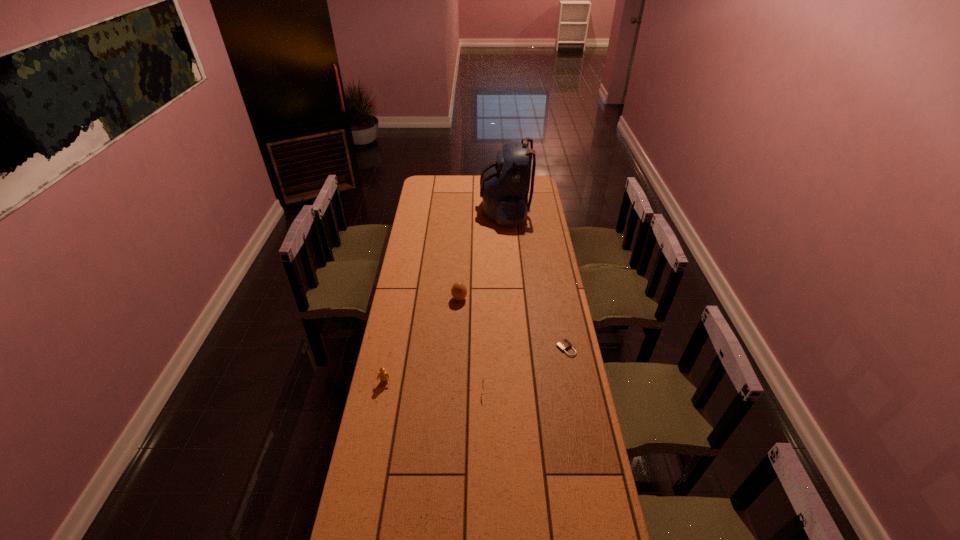
Find the location of a particular element. The height and width of the screenshot is (540, 960). vacant region located 0.150m at the front pocket of the tallest object is located at coordinates (455, 210).

Image resolution: width=960 pixels, height=540 pixels. I want to click on free space located at the front pocket of the tallest object, so click(445, 210).

Image resolution: width=960 pixels, height=540 pixels. I want to click on free space located 0.210m on the right of the second tallest object, so click(512, 299).

What are the coordinates of `free space located 0.060m on the face of the Lego` in the screenshot? It's located at (381, 399).

Find the location of a particular element. The image size is (960, 540). blank space located in front of the lenses of the sunglasses is located at coordinates (422, 390).

Image resolution: width=960 pixels, height=540 pixels. Identify the location of vacant space positioned in front of the lenses of the sunglasses. (392, 390).

This screenshot has width=960, height=540. Find the location of `blank area located in front of the lenses of the sunglasses`. blank area located in front of the lenses of the sunglasses is located at coordinates (396, 390).

Locate an element on the screen. This screenshot has height=540, width=960. free space located on the back of the shortest object is located at coordinates (560, 312).

At what (x,y) coordinates should I click in order to perform the action: click on object at the far edge. Please return your answer as a coordinate pair (x, y). This screenshot has height=540, width=960. Looking at the image, I should click on (x=504, y=184).

I want to click on object situated at the left edge, so click(x=383, y=375).